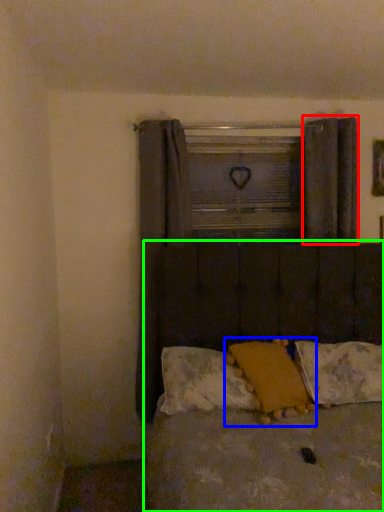
Question: Which is farther away from curtain (highlighted by a red box)? pillow (highlighted by a blue box) or bed (highlighted by a green box)?

Choices:
 (A) pillow
 (B) bed

Answer: (A)